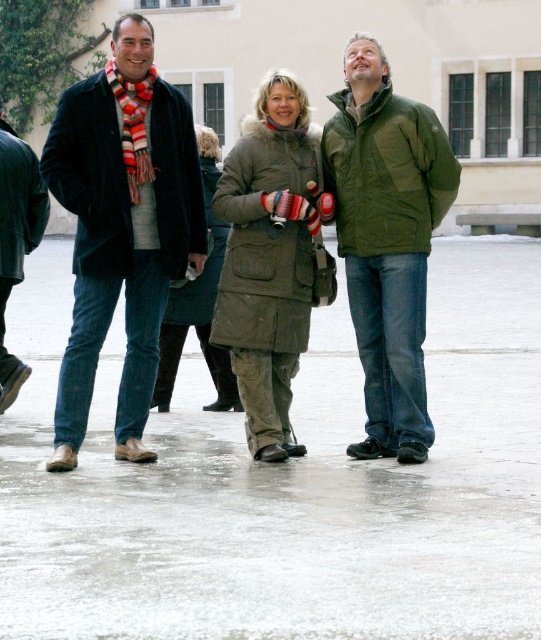
Question: Does olive green parka at center have a greater width compared to matte black jacket at left?

Choices:
 (A) no
 (B) yes

Answer: (B)

Question: Which point appears closest to the camera in this image?

Choices:
 (A) (144, 452)
 (B) (408, 240)
 (C) (23, 368)

Answer: (A)

Question: Based on their relative distances, which object is nearer to the green matte jacket at center?

Choices:
 (A) khaki canvas jacket at center
 (B) olive green parka at center

Answer: (B)

Question: Does matte black jacket at center appear on the left side of velvet black coat at left?

Choices:
 (A) no
 (B) yes

Answer: (A)

Question: Does green matte jacket at center appear on the right side of matte black jacket at left?

Choices:
 (A) yes
 (B) no

Answer: (A)

Question: Which of the following is the farthest from the observer?

Choices:
 (A) velvet black coat at left
 (B) matte black jacket at center
 (C) matte black jacket at left

Answer: (C)